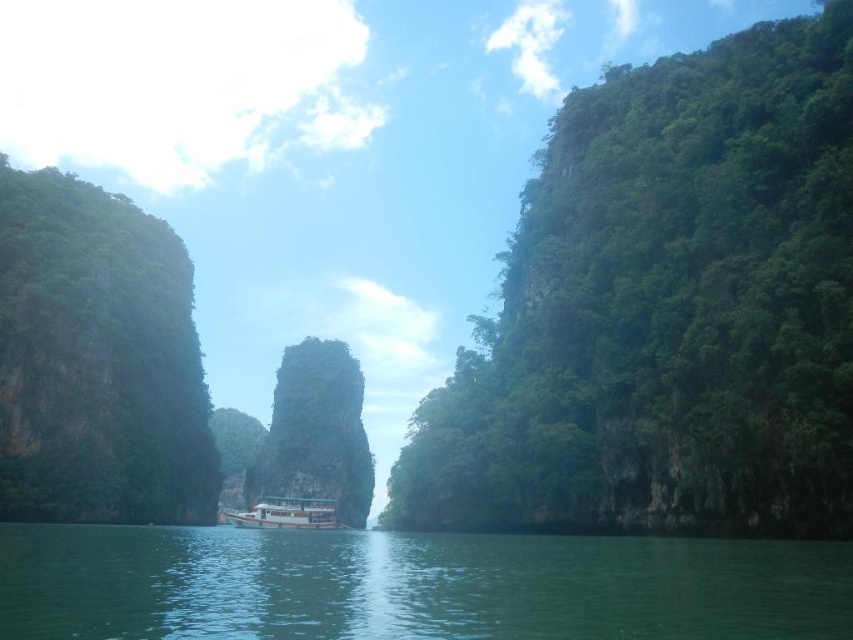
You are a photographer trying to capture the entire scene in one shot. Given that the rusty stone rock at center and the white matte boat at center are both in the frame, which object would you need to adjust your camera angle to include more of its details without moving closer?

The rusty stone rock at center is bigger than the white matte boat at center, so you would need to adjust your camera angle to include more details of the rusty stone rock at center.

You are a tourist on a boat cruise and want to take a photo of the white matte boat at center and the green smooth water at center. Which object should you focus on first if you want to capture both in the same frame without moving the camera?

The white matte boat at center is to the left of the green smooth water at center, so you should focus on the white matte boat at center first to ensure both objects are in the frame without moving the camera.

You are a tourist standing on the left side of the white matte boat at center. You want to take a photo of the rusty stone rock at center. Which direction should you look to capture it in your camera?

The rusty stone rock at center is located above the white matte boat at center, so you should look upwards to capture it in your camera.